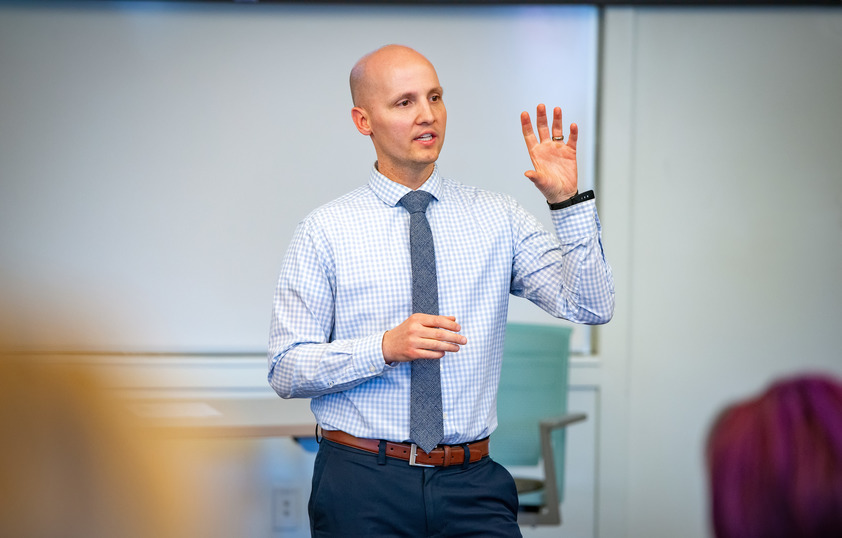
Identify the location of table. (274, 416).